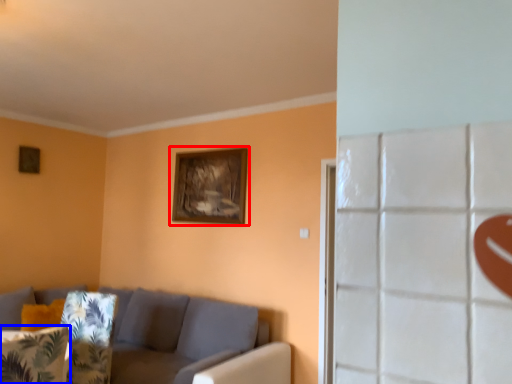
Question: Which of the following is the farthest to the observer, picture frame (highlighted by a red box) or pillow (highlighted by a blue box)?

Choices:
 (A) picture frame
 (B) pillow

Answer: (A)